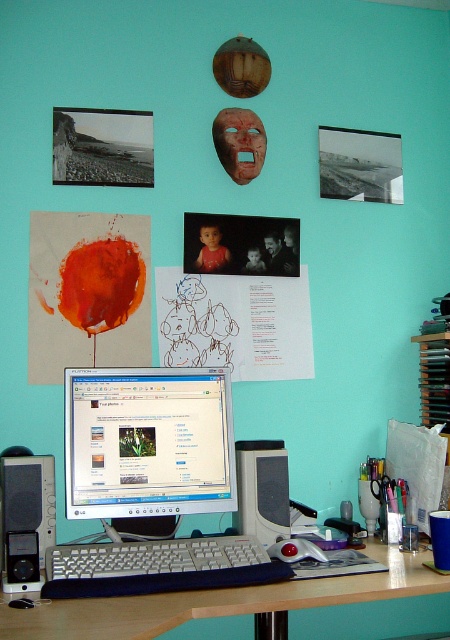
Question: Which of the following is the closest to the observer?

Choices:
 (A) (305, 557)
 (B) (175, 403)
 (C) (133, 570)
 (D) (4, 564)

Answer: (C)

Question: Is wooden at center positioned at the back of black plastic speaker at center?

Choices:
 (A) yes
 (B) no

Answer: (B)

Question: Which point is farther to the camera?

Choices:
 (A) (198, 368)
 (B) (244, 529)
 (C) (5, 636)

Answer: (A)

Question: Which object is closer to the camera taking this photo?

Choices:
 (A) white plastic monitor at center
 (B) black plastic speaker at center

Answer: (A)

Question: Can you confirm if white plastic monitor at center is wider than rubberized black mouse at center?

Choices:
 (A) yes
 (B) no

Answer: (A)

Question: Can you confirm if black plastic speaker at left is bigger than rubberized black mouse at center?

Choices:
 (A) no
 (B) yes

Answer: (B)